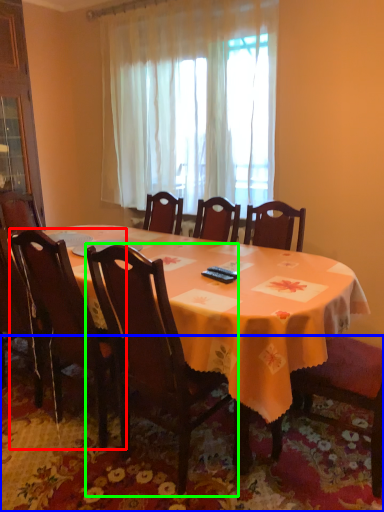
Question: Considering the real-world distances, which object is farthest from chair (highlighted by a red box)? mat (highlighted by a blue box) or chair (highlighted by a green box)?

Choices:
 (A) mat
 (B) chair

Answer: (A)